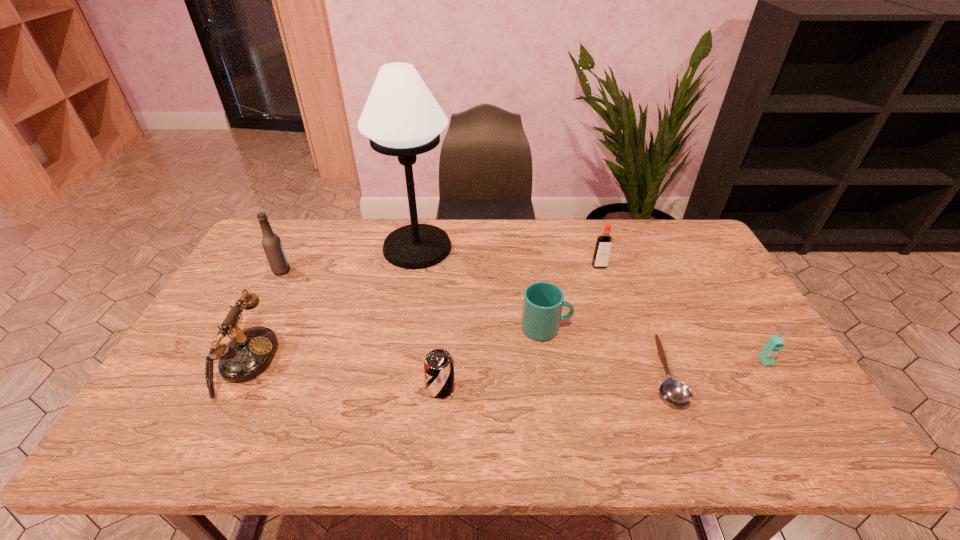
The image size is (960, 540). What are the coordinates of `free space between the tallest object and the beer bottle` in the screenshot? It's located at (349, 259).

Where is `free space that is in between the soda can and the telephone`? The height and width of the screenshot is (540, 960). free space that is in between the soda can and the telephone is located at coordinates (340, 375).

I want to click on vacant area that lies between the telephone and the cellular telephone, so click(x=503, y=362).

Where is `vacant area between the fifth object from left to right and the tallest object`? vacant area between the fifth object from left to right and the tallest object is located at coordinates (482, 288).

The image size is (960, 540). Find the location of `object that can be found as the third closest to the cellular telephone`. object that can be found as the third closest to the cellular telephone is located at coordinates (543, 302).

Find the location of `object that is the seventh nearest to the vodka`. object that is the seventh nearest to the vodka is located at coordinates (272, 245).

At what (x,y) coordinates should I click in order to perform the action: click on free point that satisfies the following two spatial constraints: 1. on the handle side of the shortest object; 2. on the left side of the fifth object from left to right. Please return your answer as a coordinate pair (x, y). Looking at the image, I should click on (553, 372).

Locate an element on the screen. The height and width of the screenshot is (540, 960). free region that satisfies the following two spatial constraints: 1. on the back side of the soda can; 2. on the side of the beer bottle with the label is located at coordinates (450, 271).

At what (x,y) coordinates should I click in order to perform the action: click on free point that satisfies the following two spatial constraints: 1. on the front and back of the vodka; 2. on the side of the seventh shortest object with the label. Please return your answer as a coordinate pair (x, y). The width and height of the screenshot is (960, 540). Looking at the image, I should click on (601, 271).